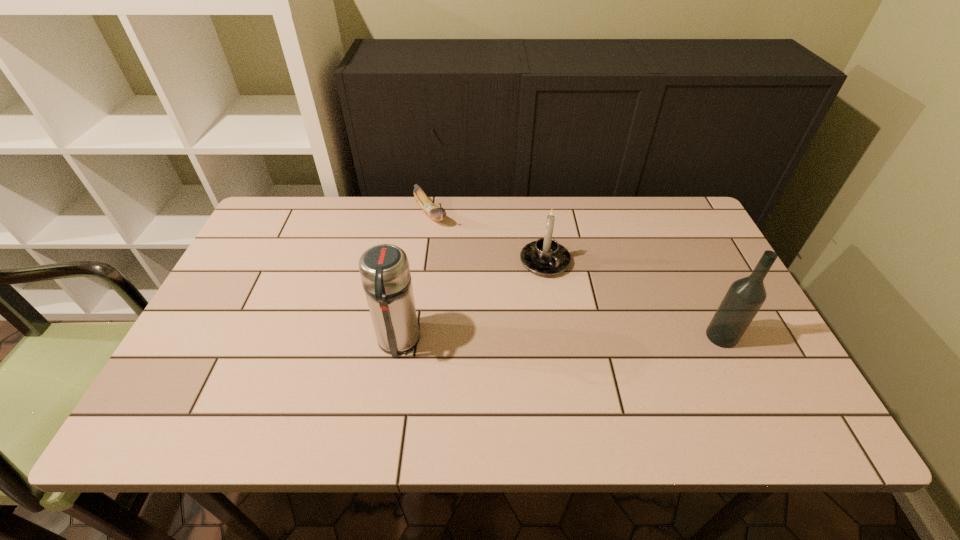
Locate an element on the screen. vacant space at the left edge is located at coordinates (232, 324).

Identify the location of free location at the right edge of the desktop. (708, 284).

At what (x,y) coordinates should I click in order to perform the action: click on vacant area at the far left corner. Please return your answer as a coordinate pair (x, y). This screenshot has width=960, height=540. Looking at the image, I should click on (314, 197).

Locate an element on the screen. Image resolution: width=960 pixels, height=540 pixels. blank space at the near left corner of the desktop is located at coordinates (210, 374).

The width and height of the screenshot is (960, 540). I want to click on blank area at the far right corner, so click(674, 204).

Identify the location of free spot between the farthest object and the thermos bottle. This screenshot has width=960, height=540. (414, 279).

I want to click on free space between the farthest object and the thermos bottle, so click(414, 279).

Where is `free space between the thermos bottle and the shortest object`? The height and width of the screenshot is (540, 960). free space between the thermos bottle and the shortest object is located at coordinates (414, 279).

The image size is (960, 540). In order to click on free space between the rightmost object and the thermos bottle in this screenshot , I will do `click(560, 339)`.

The width and height of the screenshot is (960, 540). I want to click on free point between the second farthest object and the shortest object, so click(x=488, y=238).